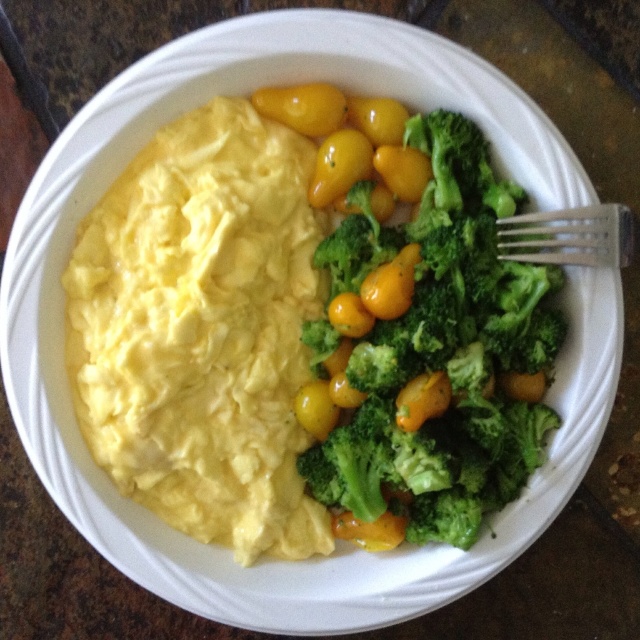
Is yellow creamy scrambled eggs at left in front of silver metallic fork at upper right?

That is False.

Is yellow creamy scrambled eggs at left above silver metallic fork at upper right?

No, yellow creamy scrambled eggs at left is not above silver metallic fork at upper right.

Does point (244, 374) come in front of point (600, 256)?

That is False.

Find the location of a particular element. yellow creamy scrambled eggs at left is located at coordinates coord(202,330).

Is green fresh broccoli at right to the right of silver metallic fork at upper right from the viewer's perspective?

Incorrect, green fresh broccoli at right is not on the right side of silver metallic fork at upper right.

Between green fresh broccoli at right and silver metallic fork at upper right, which one has less height?

silver metallic fork at upper right is shorter.

Where is `green fresh broccoli at right`? Image resolution: width=640 pixels, height=640 pixels. green fresh broccoli at right is located at coordinates (429, 352).

What do you see at coordinates (202, 330) in the screenshot? I see `yellow creamy scrambled eggs at left` at bounding box center [202, 330].

Does yellow creamy scrambled eggs at left have a lesser height compared to green fresh broccoli at right?

No.

Who is more forward, (x=120, y=224) or (x=410, y=467)?

Point (x=410, y=467) is in front.

Locate an element on the screen. Image resolution: width=640 pixels, height=640 pixels. yellow creamy scrambled eggs at left is located at coordinates (202, 330).